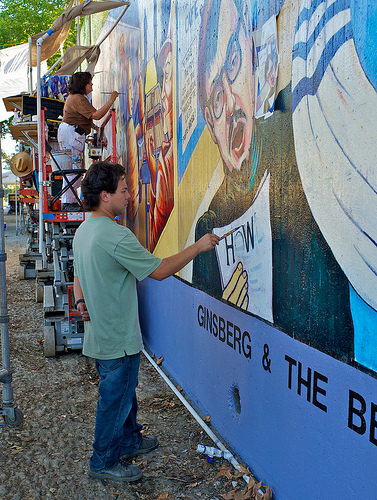
I want to click on mural, so click(146, 53), click(198, 152), click(306, 283), click(233, 329), click(180, 50), click(163, 146), click(165, 316).